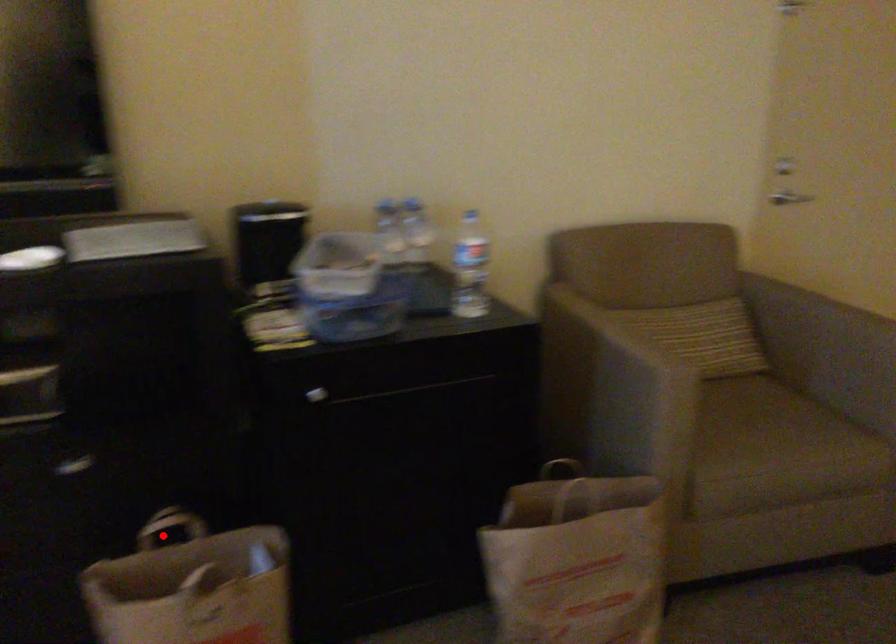
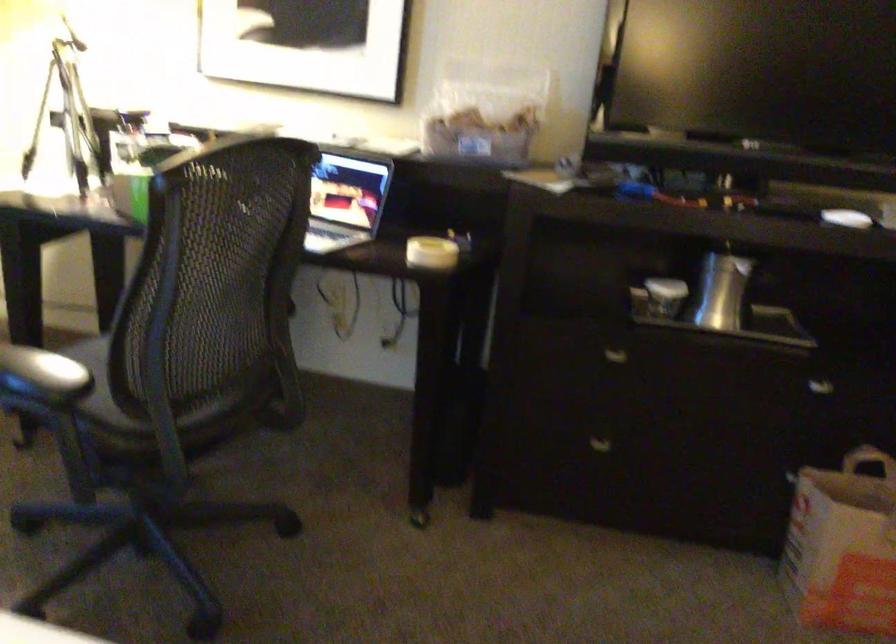
Question: I am providing you with two images of the same scene from different viewpoints. Given a red point in image1, look at the same physical point in image2. Is it:

Choices:
 (A) Closer to the viewpoint
 (B) Farther from the viewpoint

Answer: (B)